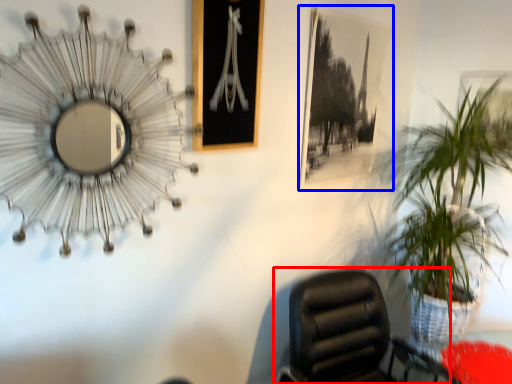
Question: Which point is further to the camera, chair (highlighted by a red box) or picture frame (highlighted by a blue box)?

Choices:
 (A) chair
 (B) picture frame

Answer: (B)